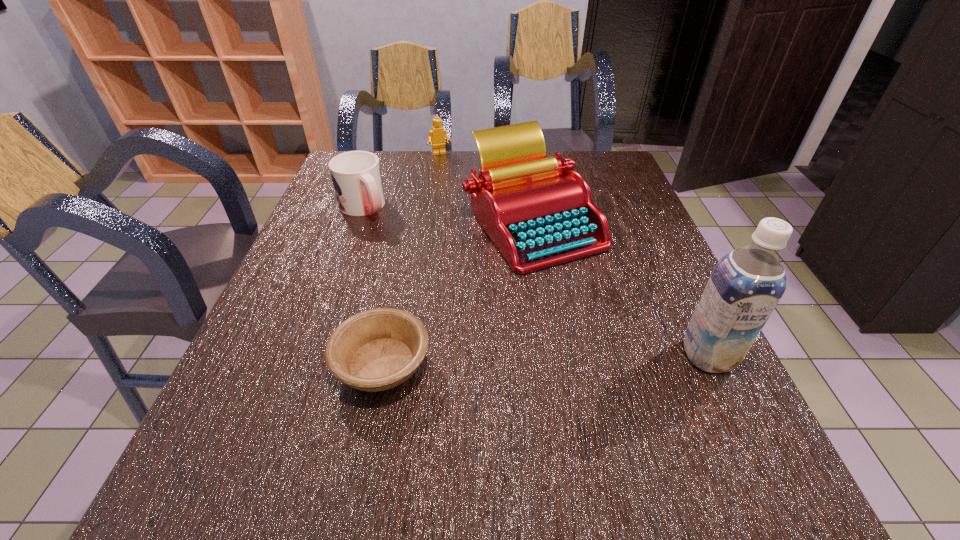
Where is `bowl`? bowl is located at coordinates (378, 349).

This screenshot has height=540, width=960. In order to click on the tallest object in this screenshot , I will do `click(746, 284)`.

This screenshot has height=540, width=960. In order to click on the rightmost object in this screenshot , I will do `click(746, 284)`.

Identify the location of Lego. (437, 135).

Identify the location of typewriter. The image size is (960, 540). pyautogui.click(x=538, y=212).

Identify the location of the fourth object from left to right. (538, 212).

This screenshot has height=540, width=960. In order to click on mug in this screenshot , I will do `click(356, 175)`.

The image size is (960, 540). What are the coordinates of `free space located on the back of the bowl` in the screenshot? It's located at (403, 258).

This screenshot has height=540, width=960. I want to click on vacant space located on the label of the tallest object, so click(744, 431).

The width and height of the screenshot is (960, 540). I want to click on vacant space located on the face of the farthest object, so 457,187.